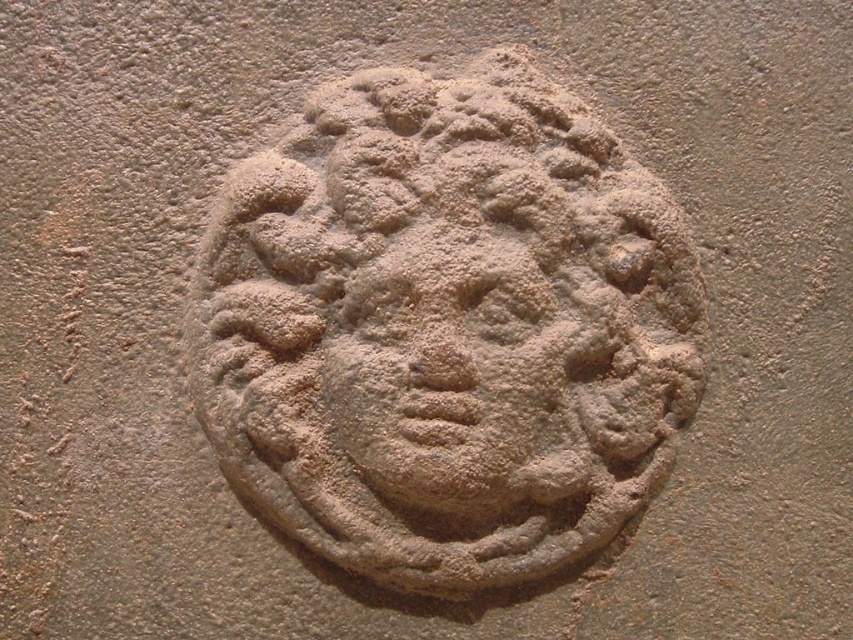
Consider the image. Can you confirm if matte sandstone face at center is positioned above matte stone face at center?

Correct, matte sandstone face at center is located above matte stone face at center.

At what (x,y) coordinates should I click in order to perform the action: click on matte sandstone face at center. Please return your answer as a coordinate pair (x, y). The image size is (853, 640). Looking at the image, I should click on (445, 326).

Is point (456, 348) in front of point (430, 317)?

Yes.

Where is `matte sandstone face at center`? matte sandstone face at center is located at coordinates (445, 326).